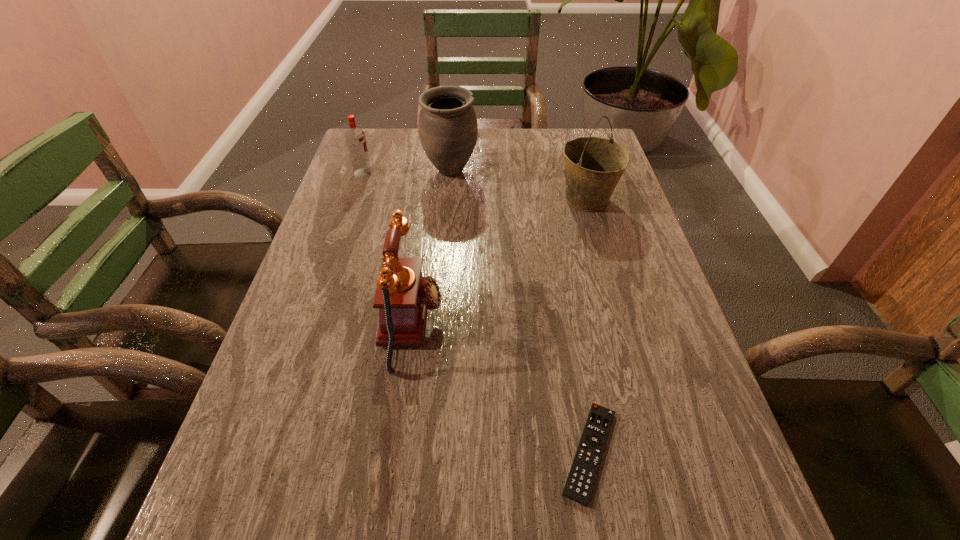
The image size is (960, 540). Find the location of `vacant region located on the front label of the fourth tallest object`. vacant region located on the front label of the fourth tallest object is located at coordinates (468, 173).

Locate an element on the screen. free space located on the back of the nearest object is located at coordinates (569, 332).

Find the location of a particular element. The height and width of the screenshot is (540, 960). object that is at the far edge is located at coordinates (448, 129).

At what (x,y) coordinates should I click in order to perform the action: click on object present at the left edge. Please return your answer as a coordinate pair (x, y). The width and height of the screenshot is (960, 540). Looking at the image, I should click on (355, 138).

Image resolution: width=960 pixels, height=540 pixels. Identify the location of object that is positioned at the right edge. click(x=593, y=166).

In the image, there is a desktop. Where is `vacant space at the left edge`? vacant space at the left edge is located at coordinates (380, 230).

Image resolution: width=960 pixels, height=540 pixels. Find the location of `vacant space at the right edge of the desktop`. vacant space at the right edge of the desktop is located at coordinates (629, 253).

In the image, there is a desktop. Where is `vacant space at the far right corner`? Image resolution: width=960 pixels, height=540 pixels. vacant space at the far right corner is located at coordinates [561, 133].

This screenshot has width=960, height=540. What are the coordinates of `free point between the remote control and the second nearest object` in the screenshot? It's located at (501, 388).

Find the location of a particular element. The width and height of the screenshot is (960, 540). free spot between the leftmost object and the wine bucket is located at coordinates (474, 186).